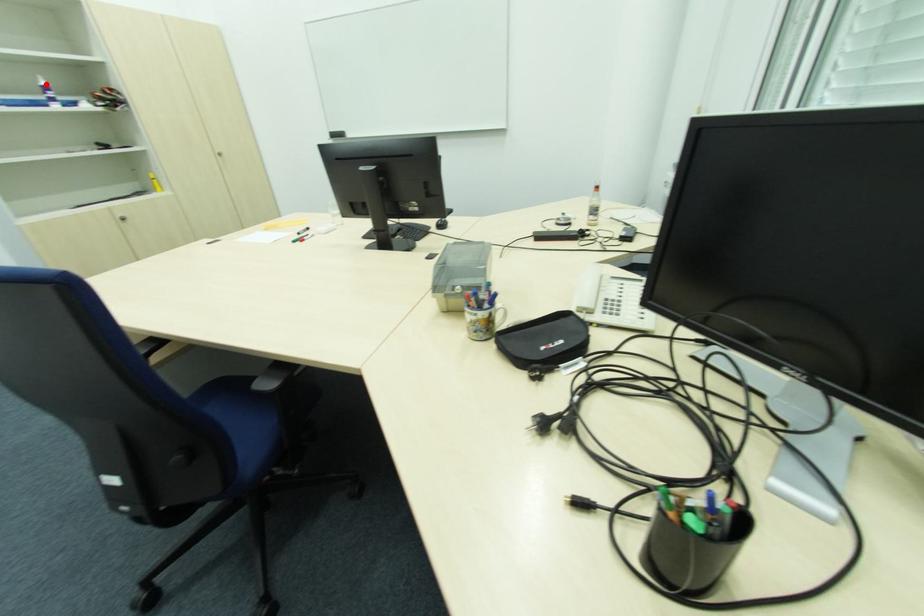
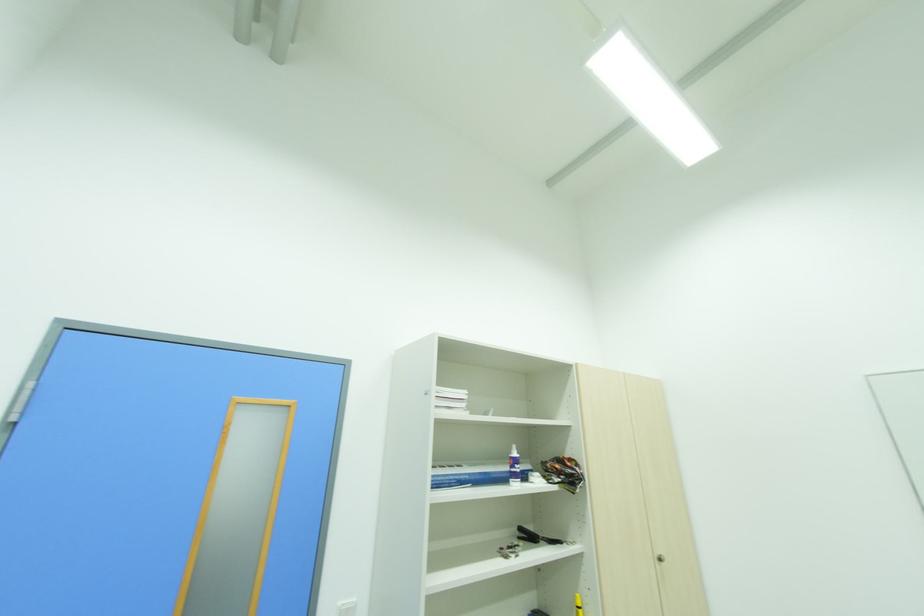
Find the pixel in the second image that matches the highlighted location in the first image.

(517, 455)